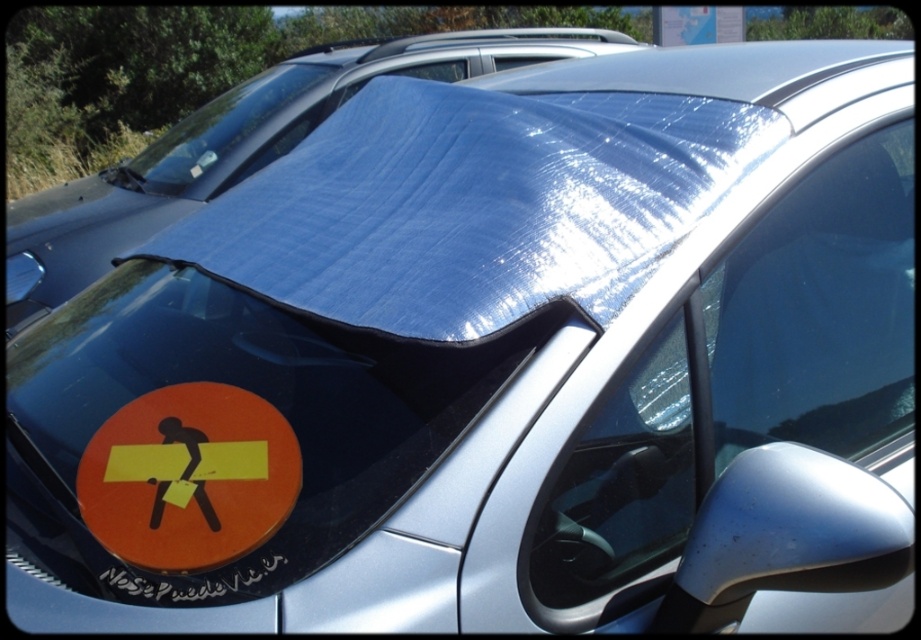
You are standing in front of a car with a reflective sunshade on the windshield. There is a point at coordinates point (25, 205). Can you estimate how far this point is from you?

The distance of point (25, 205) from the viewer is 4.89 meters.

From the picture: You are a delivery driver who just arrived at the destination. You see the blue reflective tarp at center and the orange matte sticker at lower left on the windshield. Which object is closer to you?

The orange matte sticker at lower left is behind the blue reflective tarp at center, so the blue reflective tarp at center is closer to you.

You are a delivery person trying to place a package on the car. The car has a blue reflective tarp at center. Where should you place the package so it doesn not get reflected by the tarp?

The blue reflective tarp at center is located at point (240, 148), so you should avoid placing the package near that area to prevent it from being reflected.